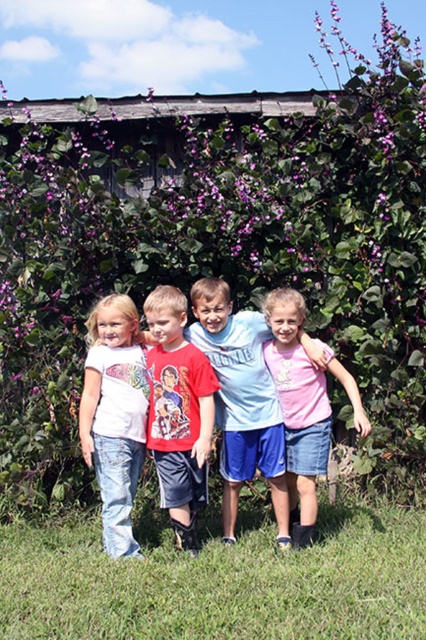
Is white denim jeans at left below red cotton t-shirt at center?

Yes, white denim jeans at left is below red cotton t-shirt at center.

Who is positioned more to the left, white denim jeans at left or red cotton t-shirt at center?

white denim jeans at left is more to the left.

Is point (97, 404) closer to viewer compared to point (198, 460)?

No, (97, 404) is behind (198, 460).

Locate an element on the screen. white denim jeans at left is located at coordinates (115, 413).

Is light blue cotton shirt at center positioned in front of red cotton t-shirt at center?

No.

Which is behind, point (222, 524) or point (189, 416)?

Point (222, 524)

Which is in front, point (226, 344) or point (186, 346)?

Point (186, 346)

Locate an element on the screen. This screenshot has height=640, width=426. light blue cotton shirt at center is located at coordinates (241, 401).

Can you confirm if light blue cotton shirt at center is positioned above pink cotton shirt at center?

No, light blue cotton shirt at center is not above pink cotton shirt at center.

Is light blue cotton shirt at center to the left of pink cotton shirt at center from the viewer's perspective?

Correct, you'll find light blue cotton shirt at center to the left of pink cotton shirt at center.

Is point (285, 492) farther from viewer compared to point (281, 397)?

No, it is not.

Find the location of a particular element. light blue cotton shirt at center is located at coordinates (241, 401).